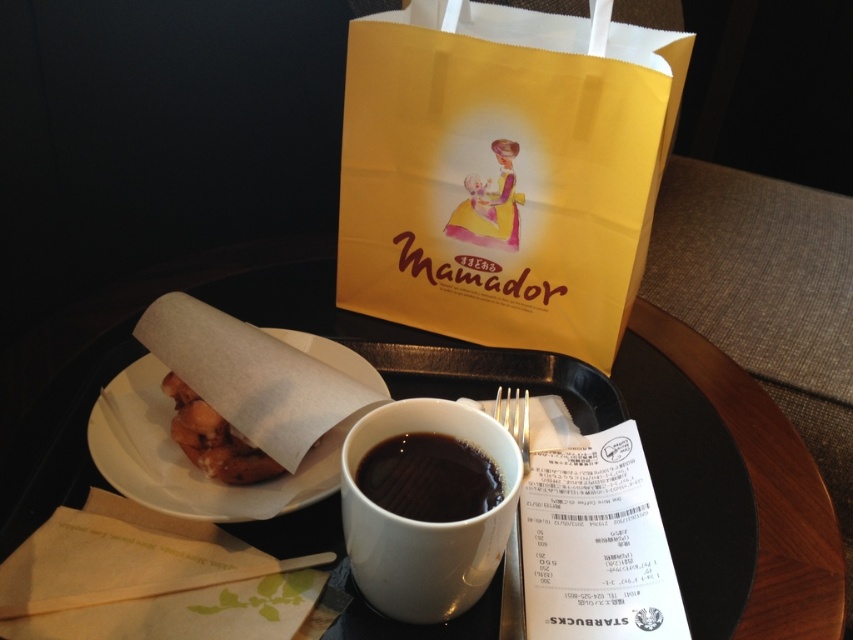
Question: Among these points, which one is farthest from the camera?

Choices:
 (A) (583, 56)
 (B) (73, 413)
 (C) (508, 387)

Answer: (C)

Question: Is yellow paper bag at upper center thinner than silver metallic fork at upper center?

Choices:
 (A) yes
 (B) no

Answer: (B)

Question: Is brown paper plate at center above silver metallic fork at upper center?

Choices:
 (A) yes
 (B) no

Answer: (A)

Question: Considering the real-world distances, which object is farthest from the white ceramic mug at center?

Choices:
 (A) brown paper plate at center
 (B) white matte tray at center
 (C) yellow paper bag at upper center
 (D) silver metallic fork at upper center

Answer: (C)

Question: Which point is closer to the camera?

Choices:
 (A) (608, 240)
 (B) (393, 477)
 (C) (500, 403)

Answer: (B)

Question: Where is black matte cup at center located in relation to silver metallic fork at upper center in the image?

Choices:
 (A) above
 (B) below

Answer: (B)